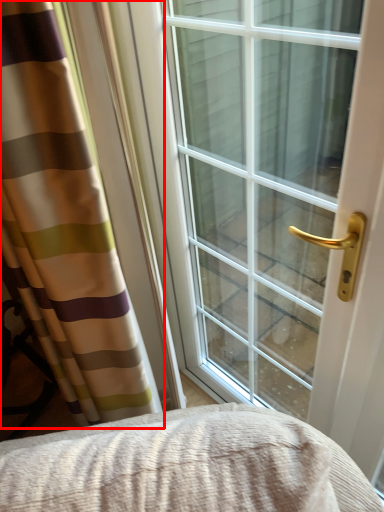
Question: Observing the image, what is the correct spatial positioning of curtain (annotated by the red box) in reference to window?

Choices:
 (A) left
 (B) right

Answer: (A)